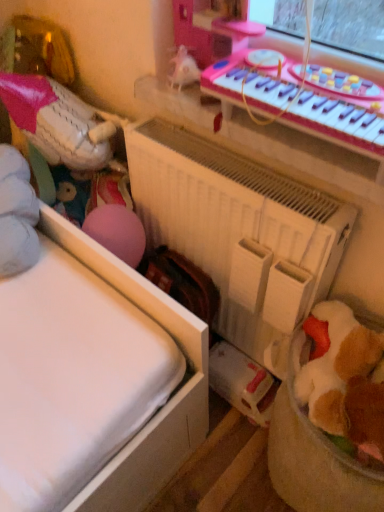
Question: Considering the relative sizes of pink plastic musical keyboard at upper right and white matte baseball glove at left, the first toy viewed from the left, in the image provided, is pink plastic musical keyboard at upper right taller than white matte baseball glove at left, the first toy viewed from the left,?

Choices:
 (A) yes
 (B) no

Answer: (B)

Question: Does pink plastic musical keyboard at upper right have a smaller size compared to white matte baseball glove at left, the 2th toy positioned from the bottom?

Choices:
 (A) no
 (B) yes

Answer: (B)

Question: Is white matte baseball glove at left, the 1th toy positioned from the top, inside pink plastic musical keyboard at upper right?

Choices:
 (A) no
 (B) yes

Answer: (A)

Question: Is pink plastic musical keyboard at upper right not within white matte baseball glove at left, arranged as the second toy when viewed from the front?

Choices:
 (A) no
 (B) yes

Answer: (B)

Question: Does pink plastic musical keyboard at upper right have a greater width compared to white matte baseball glove at left, positioned as the second toy in right-to-left order?

Choices:
 (A) no
 (B) yes

Answer: (A)

Question: From the image's perspective, would you say pink plastic musical keyboard at upper right is positioned over white matte baseball glove at left, the first toy viewed from the left?

Choices:
 (A) no
 (B) yes

Answer: (A)

Question: Can you confirm if soft brown plush toy at lower right, positioned as the 2th toy in back-to-front order, is positioned to the right of pink plastic musical keyboard at upper right?

Choices:
 (A) yes
 (B) no

Answer: (A)

Question: From a real-world perspective, is soft brown plush toy at lower right, positioned as the 2th toy in back-to-front order, on top of pink plastic musical keyboard at upper right?

Choices:
 (A) yes
 (B) no

Answer: (B)

Question: Is soft brown plush toy at lower right, marked as the second toy in a top-to-bottom arrangement, looking in the opposite direction of pink plastic musical keyboard at upper right?

Choices:
 (A) no
 (B) yes

Answer: (A)

Question: Is soft brown plush toy at lower right, positioned as the 2th toy in back-to-front order, outside pink plastic musical keyboard at upper right?

Choices:
 (A) no
 (B) yes

Answer: (B)

Question: Can you see soft brown plush toy at lower right, placed as the 1th toy when sorted from front to back, touching pink plastic musical keyboard at upper right?

Choices:
 (A) yes
 (B) no

Answer: (B)

Question: Can you confirm if soft brown plush toy at lower right, the second toy positioned from the left, is taller than pink plastic musical keyboard at upper right?

Choices:
 (A) no
 (B) yes

Answer: (B)

Question: Considering the relative sizes of white matte baseball glove at left, positioned as the second toy in right-to-left order, and white matte radiator at center in the image provided, is white matte baseball glove at left, positioned as the second toy in right-to-left order, smaller than white matte radiator at center?

Choices:
 (A) yes
 (B) no

Answer: (A)